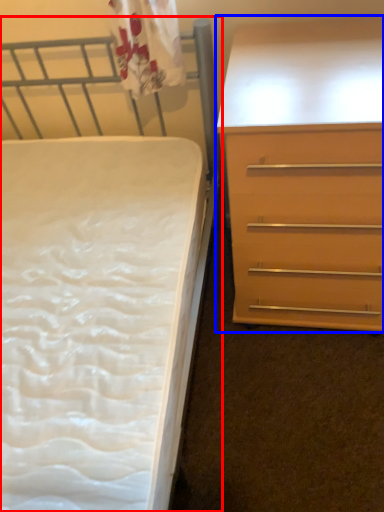
Question: Which object is further to the camera taking this photo, bed (highlighted by a red box) or chest of drawers (highlighted by a blue box)?

Choices:
 (A) bed
 (B) chest of drawers

Answer: (B)